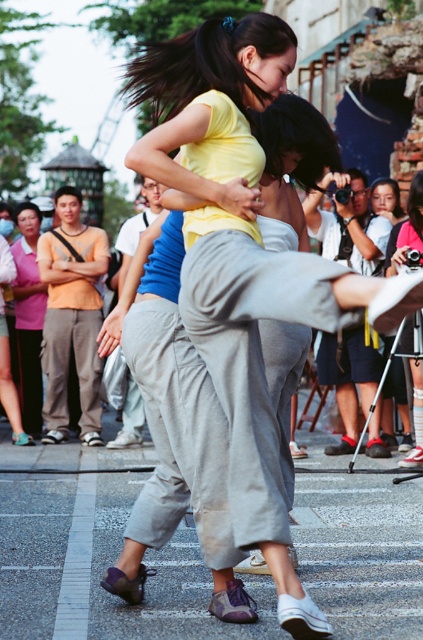
Question: Which point appears closest to the camera in this image?

Choices:
 (A) (370, 216)
 (B) (51, 342)
 (C) (118, 278)

Answer: (A)

Question: Which object is the closest to the pink fabric at lower left?

Choices:
 (A) orange cotton shirt at left
 (B) matte pink shirt at center
 (C) matte yellow shirt at center
 (D) blue cotton shirt at center

Answer: (A)

Question: Which point is closer to the camera?

Choices:
 (A) (422, 198)
 (B) (353, 384)

Answer: (A)

Question: Is matte yellow shirt at center above matte pink shirt at center?

Choices:
 (A) no
 (B) yes

Answer: (B)

Question: Considering the relative positions of blue cotton shirt at center and matte pink shirt at center in the image provided, where is blue cotton shirt at center located with respect to matte pink shirt at center?

Choices:
 (A) right
 (B) left

Answer: (B)

Question: Considering the relative positions of matte yellow shirt at center and orange cotton shirt at left in the image provided, where is matte yellow shirt at center located with respect to orange cotton shirt at left?

Choices:
 (A) left
 (B) right

Answer: (B)